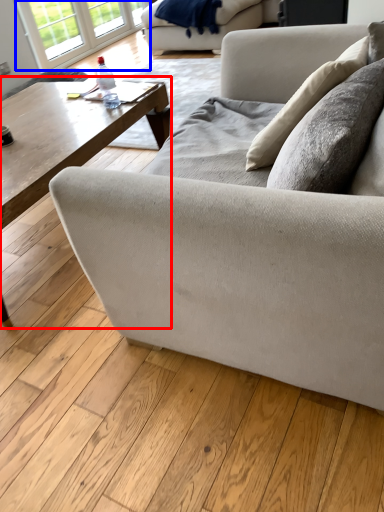
Question: Which object is closer to the camera taking this photo, coffee table (highlighted by a red box) or window (highlighted by a blue box)?

Choices:
 (A) coffee table
 (B) window

Answer: (A)